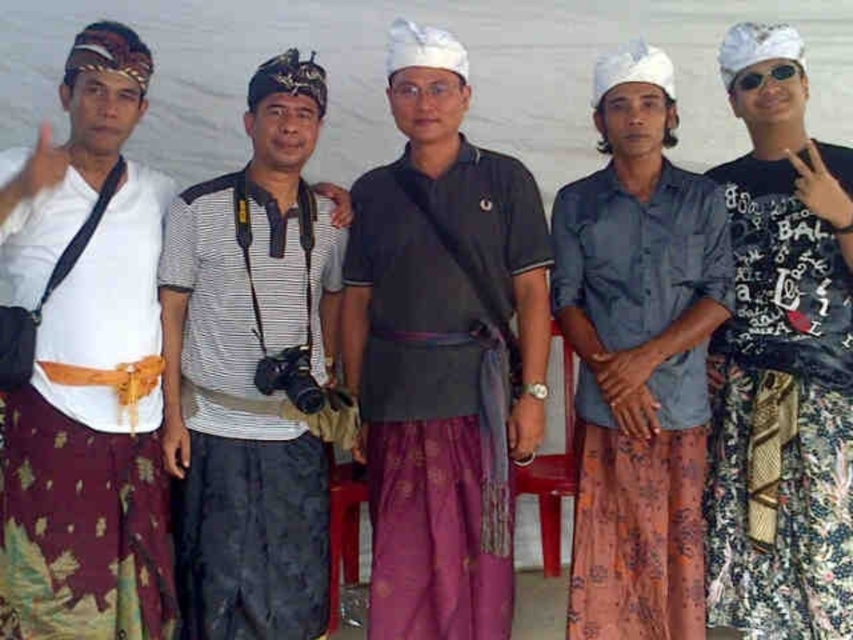
Question: Which object is farther from the camera taking this photo?

Choices:
 (A) white matte shirt at left
 (B) sunglasses at right
 (C) striped cotton shirt at center
 (D) floral fabric skirt at right

Answer: (B)

Question: Which of the following is the closest to the observer?

Choices:
 (A) floral fabric skirt at right
 (B) dark gray cotton shirt at center
 (C) striped cotton shirt at center
 (D) white matte shirt at left

Answer: (D)

Question: Based on their relative distances, which object is farther from the blue cotton shirt at center?

Choices:
 (A) white matte shirt at left
 (B) dark gray cotton shirt at center
 (C) striped cotton shirt at center
 (D) sunglasses at right

Answer: (A)

Question: Is striped cotton shirt at center wider than floral fabric skirt at right?

Choices:
 (A) yes
 (B) no

Answer: (A)

Question: Considering the relative positions of striped cotton shirt at center and floral fabric skirt at right in the image provided, where is striped cotton shirt at center located with respect to floral fabric skirt at right?

Choices:
 (A) above
 (B) below

Answer: (A)

Question: Does dark gray cotton shirt at center have a larger size compared to sunglasses at right?

Choices:
 (A) no
 (B) yes

Answer: (B)